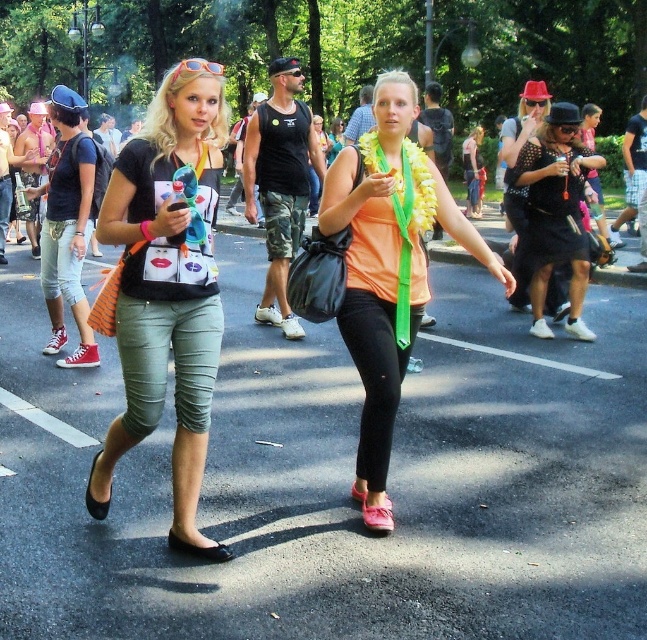
This screenshot has width=647, height=640. What do you see at coordinates (388, 268) in the screenshot?
I see `orange fabric top at center` at bounding box center [388, 268].

Which is above, orange fabric top at center or black leather flat shoe at lower center?

orange fabric top at center

Is point (400, 305) positioned in front of point (188, 548)?

No, it is not.

Identify the location of orange fabric top at center. The image size is (647, 640). coord(388,268).

Between matte black shirt at left and black studded dress at center, which one appears on the left side from the viewer's perspective?

From the viewer's perspective, matte black shirt at left appears more on the left side.

Which is behind, point (190, 138) or point (564, 253)?

Positioned behind is point (564, 253).

You are a GUI agent. You are given a task and a screenshot of the screen. Output one action in this format:
    pyautogui.click(x=<x>, y=<y>)
    Task: Click on the matte black shirt at left
    
    Given the screenshot: What is the action you would take?
    pyautogui.click(x=168, y=278)

Where is `matte black shirt at left`? The image size is (647, 640). matte black shirt at left is located at coordinates (168, 278).

In the scene shown: Can you confirm if matte black shirt at left is positioned below orange fabric top at center?

No.

Between matte black shirt at left and orange fabric top at center, which one is positioned higher?

matte black shirt at left is above.

Image resolution: width=647 pixels, height=640 pixels. Describe the element at coordinates (168, 278) in the screenshot. I see `matte black shirt at left` at that location.

At what (x,y) coordinates should I click in order to perform the action: click on matte black shirt at left. Please return your answer as a coordinate pair (x, y). This screenshot has width=647, height=640. Looking at the image, I should click on (168, 278).